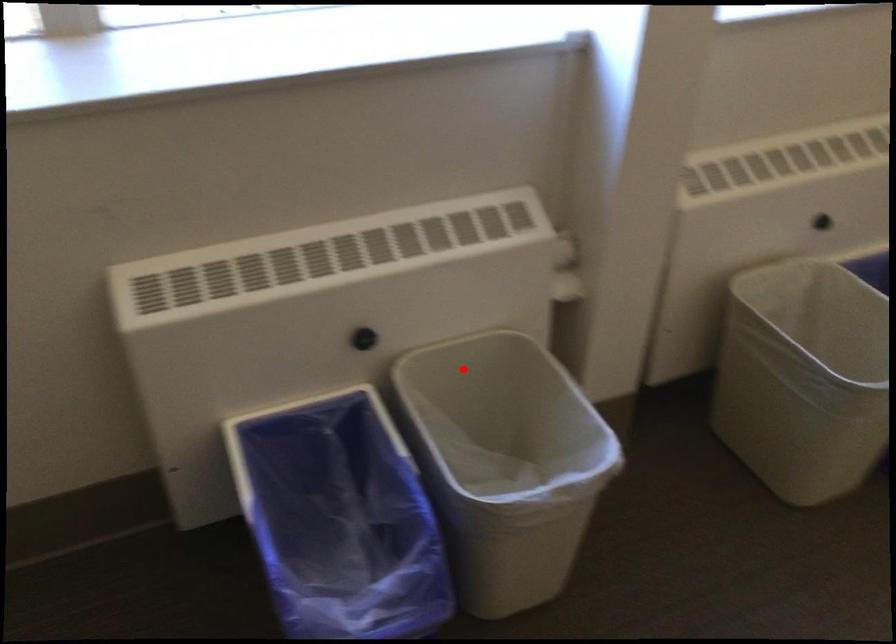
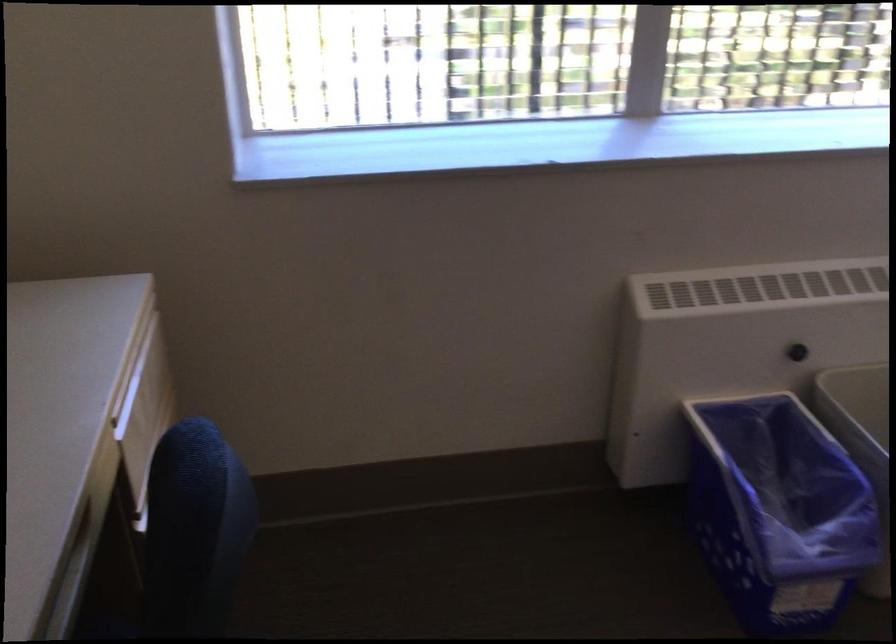
Question: I am providing you with two images of the same scene from different viewpoints. A red point is shown in image1. For the corresponding object point in image2, is it positioned nearer or farther from the camera?

Choices:
 (A) Nearer
 (B) Farther

Answer: (B)